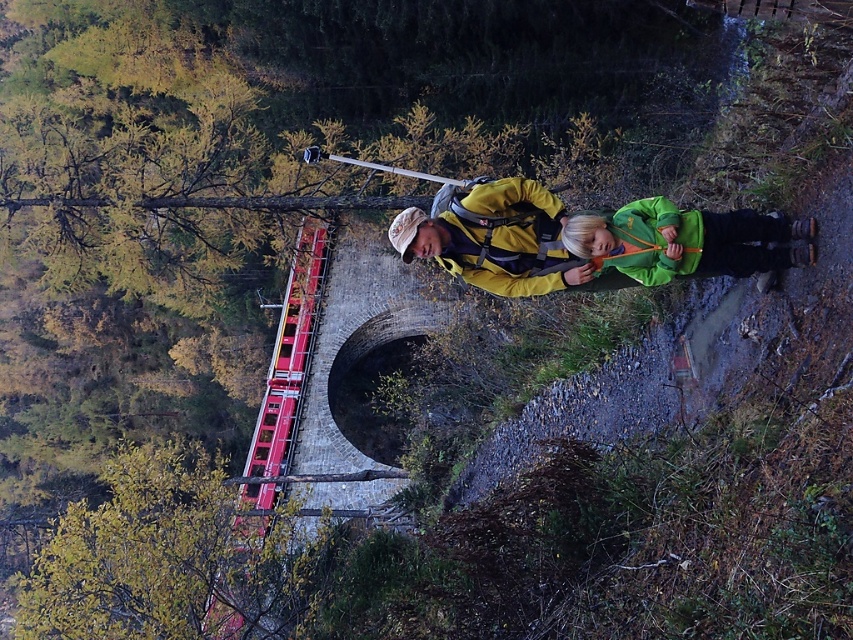
Is green fleece jacket at center wider than red plastic ladder at lower left?

No, green fleece jacket at center is not wider than red plastic ladder at lower left.

Image resolution: width=853 pixels, height=640 pixels. In order to click on green fleece jacket at center in this screenshot , I will do `click(686, 241)`.

Describe the element at coordinates (686, 241) in the screenshot. I see `green fleece jacket at center` at that location.

I want to click on green fleece jacket at center, so click(686, 241).

Does yellow matte jacket at center have a greater width compared to green fleece jacket at lower right?

Yes.

What do you see at coordinates (495, 237) in the screenshot?
I see `yellow matte jacket at center` at bounding box center [495, 237].

At what (x,y) coordinates should I click in order to perform the action: click on yellow matte jacket at center. Please return your answer as a coordinate pair (x, y). The width and height of the screenshot is (853, 640). Looking at the image, I should click on 495,237.

Is yellow matte jacket at center positioned in front of red plastic ladder at lower left?

Yes, it is in front of red plastic ladder at lower left.

Who is more distant from viewer, (463, 218) or (267, 448)?

The point (267, 448) is more distant.

Does point (548, 220) come behind point (242, 525)?

No, (548, 220) is in front of (242, 525).

Identify the location of yellow matte jacket at center. The height and width of the screenshot is (640, 853). (495, 237).